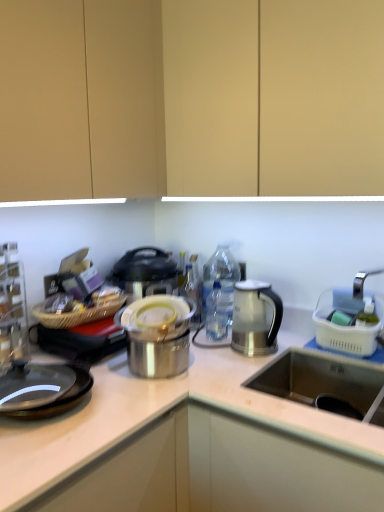
Question: From a real-world perspective, is shiny metallic pot at center, placed as the 1th appliance when sorted from left to right, located higher than white plastic basket at right, which appears as the 2th appliance when viewed from the left?

Choices:
 (A) no
 (B) yes

Answer: (A)

Question: Would you say shiny metallic pot at center, placed as the 1th appliance when sorted from left to right, is outside white plastic basket at right, the first appliance positioned from the right?

Choices:
 (A) yes
 (B) no

Answer: (A)

Question: Is shiny metallic pot at center, placed as the 1th appliance when sorted from left to right, shorter than white plastic basket at right, the first appliance positioned from the right?

Choices:
 (A) no
 (B) yes

Answer: (B)

Question: Is shiny metallic pot at center, placed as the 1th appliance when sorted from left to right, facing towards white plastic basket at right, the first appliance positioned from the right?

Choices:
 (A) no
 (B) yes

Answer: (A)

Question: Is point pos(316,315) closer or farther from the camera than point pos(173,302)?

Choices:
 (A) farther
 (B) closer

Answer: (A)

Question: From a real-world perspective, relative to shiny metallic pot at center, positioned as the 2th appliance in right-to-left order, is white plastic basket at right, the first appliance positioned from the right, vertically above or below?

Choices:
 (A) above
 (B) below

Answer: (A)

Question: In the image, is white plastic basket at right, which appears as the 2th appliance when viewed from the left, positioned in front of or behind shiny metallic pot at center, positioned as the 2th appliance in right-to-left order?

Choices:
 (A) behind
 (B) front

Answer: (A)

Question: In terms of size, does white plastic basket at right, which appears as the 2th appliance when viewed from the left, appear bigger or smaller than shiny metallic pot at center, placed as the 1th appliance when sorted from left to right?

Choices:
 (A) big
 (B) small

Answer: (A)

Question: Considering the positions of matte wood cabinet at upper center and white plastic basket at right, the first appliance positioned from the right, in the image, is matte wood cabinet at upper center taller or shorter than white plastic basket at right, the first appliance positioned from the right,?

Choices:
 (A) short
 (B) tall

Answer: (B)

Question: Is matte wood cabinet at upper center wider or thinner than white plastic basket at right, the first appliance positioned from the right?

Choices:
 (A) thin
 (B) wide

Answer: (B)

Question: Do you think matte wood cabinet at upper center is within white plastic basket at right, the first appliance positioned from the right, or outside of it?

Choices:
 (A) inside
 (B) outside

Answer: (B)

Question: Based on their sizes in the image, would you say matte wood cabinet at upper center is bigger or smaller than white plastic basket at right, which appears as the 2th appliance when viewed from the left?

Choices:
 (A) big
 (B) small

Answer: (A)

Question: Is black glass gas stove at left taller or shorter than matte wood cabinet at upper center?

Choices:
 (A) tall
 (B) short

Answer: (B)

Question: Relative to matte wood cabinet at upper center, is black glass gas stove at left in front or behind?

Choices:
 (A) front
 (B) behind

Answer: (A)